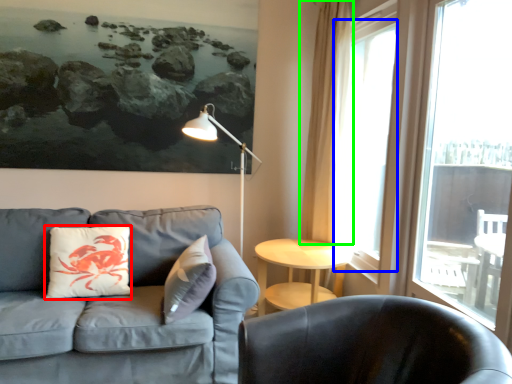
Question: Which object is the closest to the pillow (highlighted by a red box)? Choose among these: window (highlighted by a blue box) or curtain (highlighted by a green box).

Choices:
 (A) window
 (B) curtain

Answer: (B)